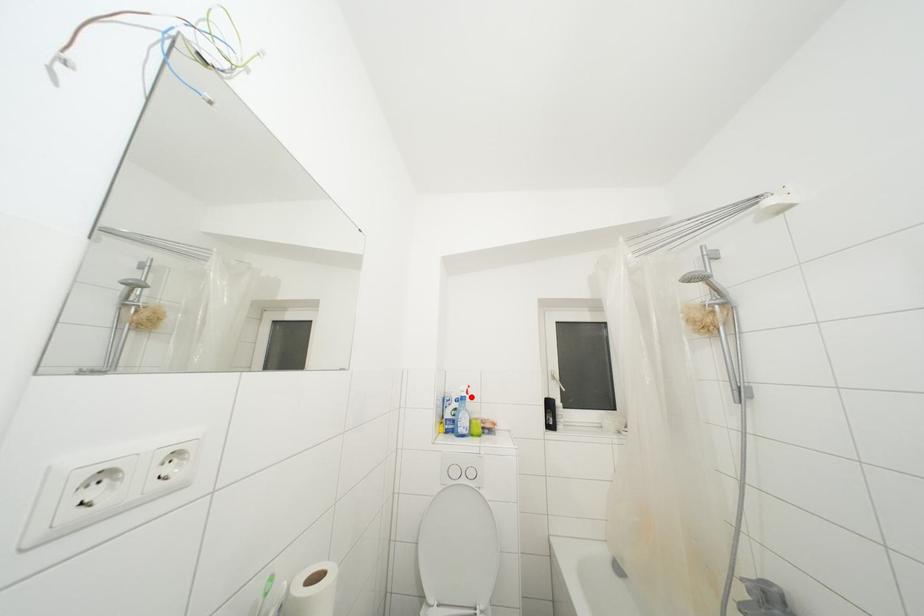
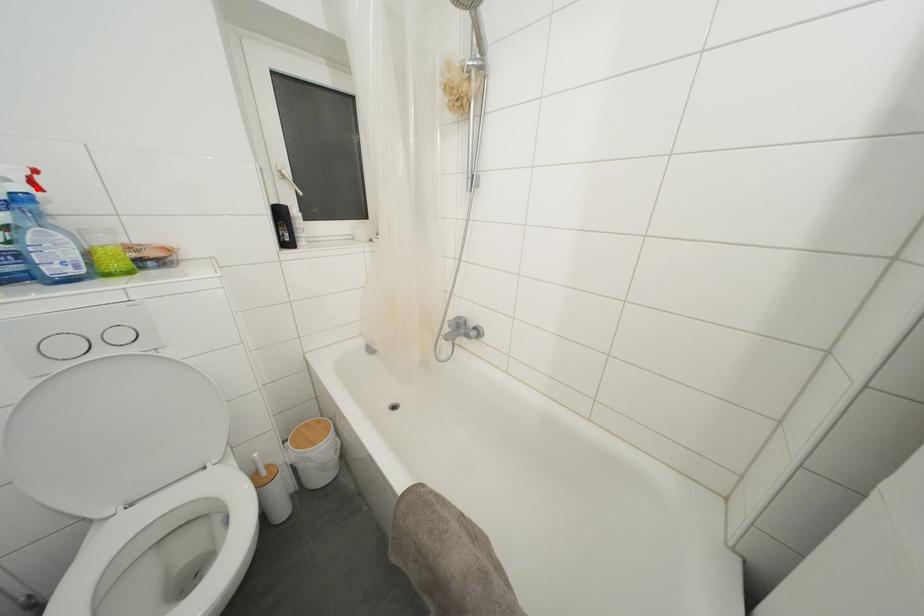
From the picture: I am providing you with two images of the same scene from different viewpoints. A red point is marked on the first image and another point is marked on the second image. Are the points marked in image1 and image2 representing the same 3D position?

Yes